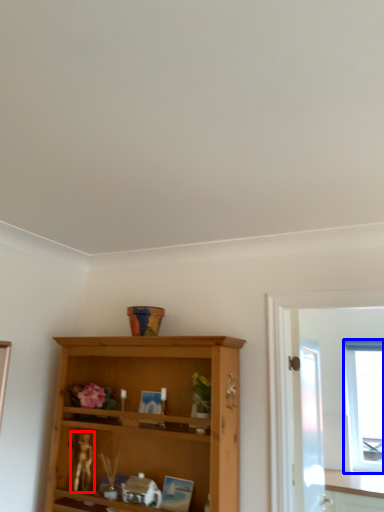
Question: Which object appears farthest to the camera in this image, miniature (highlighted by a red box) or window (highlighted by a blue box)?

Choices:
 (A) miniature
 (B) window

Answer: (B)